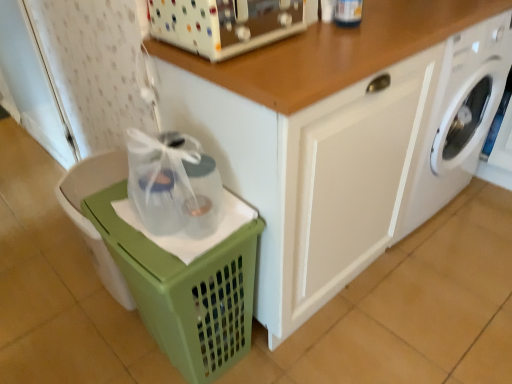
In order to face white glossy washing machine at lower right, should I rotate leftwards or rightwards?

A 22.754 degree turn to the right will do.

Describe the element at coordinates (224, 24) in the screenshot. I see `white plastic toaster at upper center` at that location.

Find the location of `green plastic basket at lower left`. green plastic basket at lower left is located at coordinates (89, 221).

From the image's perspective, is green plastic basket at lower left positioned above or below white glossy washing machine at lower right?

Based on their image positions, green plastic basket at lower left is located beneath white glossy washing machine at lower right.

Can you confirm if green plastic basket at lower left is taller than white glossy washing machine at lower right?

No, green plastic basket at lower left is not taller than white glossy washing machine at lower right.

Who is bigger, green plastic basket at lower left or white glossy washing machine at lower right?

With larger size is white glossy washing machine at lower right.

Measure the distance from green plastic basket at lower left to white glossy washing machine at lower right.

1.06 meters.

Considering the relative sizes of white textured screen door at left and green plastic basket at lower left in the image provided, is white textured screen door at left bigger than green plastic basket at lower left?

Indeed, white textured screen door at left has a larger size compared to green plastic basket at lower left.

Can you confirm if white textured screen door at left is shorter than green plastic basket at lower left?

Incorrect, the height of white textured screen door at left does not fall short of that of green plastic basket at lower left.

The image size is (512, 384). I want to click on dish washer below the white textured screen door at left (from a real-world perspective), so click(89, 221).

Which of these two, white textured screen door at left or green plastic basket at lower left, is wider?

Wider between the two is green plastic basket at lower left.

Consider the image. Is white textured screen door at left a part of green plastic basket at lower left?

Definitely not — white textured screen door at left is not inside green plastic basket at lower left.

Between green plastic basket at lower left and white textured screen door at left, which one has more height?

white textured screen door at left is taller.

From the image's perspective, who appears lower, green plastic basket at lower left or white textured screen door at left?

green plastic basket at lower left appears lower in the image.

Considering the sizes of green plastic basket at lower left and white textured screen door at left in the image, is green plastic basket at lower left wider or thinner than white textured screen door at left?

green plastic basket at lower left is wider than white textured screen door at left.

Which object is positioned more to the right, white plastic toaster at upper center or white glossy washing machine at lower right?

white glossy washing machine at lower right.

Measure the distance from white plastic toaster at upper center to white glossy washing machine at lower right.

white plastic toaster at upper center is 69.51 centimeters from white glossy washing machine at lower right.

At what (x,y) coordinates should I click in order to perform the action: click on appliance that appears above the white glossy washing machine at lower right (from a real-world perspective). Please return your answer as a coordinate pair (x, y). The height and width of the screenshot is (384, 512). Looking at the image, I should click on (224, 24).

Is white plastic toaster at upper center smaller than white glossy washing machine at lower right?

Indeed, white plastic toaster at upper center has a smaller size compared to white glossy washing machine at lower right.

Is green plastic basket at lower left oriented away from white plastic toaster at upper center?

No, green plastic basket at lower left's orientation is not away from white plastic toaster at upper center.

Based on the photo, from a real-world perspective, is green plastic basket at lower left positioned over white plastic toaster at upper center based on gravity?

No.

How different are the orientations of green plastic basket at lower left and white plastic toaster at upper center in degrees?

92.2 degrees.

Who is smaller, green plastic basket at lower left or white plastic toaster at upper center?

white plastic toaster at upper center.

Which object is further away from the camera taking this photo, white glossy cabinet at center or green plastic basket at lower left?

Positioned behind is green plastic basket at lower left.

Considering the relative sizes of white glossy cabinet at center and green plastic basket at lower left in the image provided, is white glossy cabinet at center taller than green plastic basket at lower left?

Yes.

From the image's perspective, is white glossy cabinet at center above green plastic basket at lower left?

Yes, from the image's perspective, white glossy cabinet at center is over green plastic basket at lower left.

Can you see white glossy cabinet at center touching green plastic basket at lower left?

No, white glossy cabinet at center is not in contact with green plastic basket at lower left.

From the image's perspective, which is below, white textured screen door at left or white plastic toaster at upper center?

white plastic toaster at upper center.

Is white plastic toaster at upper center at the back of white textured screen door at left?

No, white textured screen door at left's orientation is not away from white plastic toaster at upper center.

Which of these two, white textured screen door at left or white plastic toaster at upper center, is thinner?

white textured screen door at left.

Find the location of a particular element. Image resolution: width=512 pixels, height=384 pixels. dish washer to the left of white glossy washing machine at lower right is located at coordinates (89, 221).

Where is `screen door located above the green plastic basket at lower left (from the image's perspective)`? screen door located above the green plastic basket at lower left (from the image's perspective) is located at coordinates (32, 84).

Looking at this image, estimate the real-world distances between objects in this image. Which object is closer to green plastic basket at lower left, white glossy washing machine at lower right or green plastic basket at lower left?

green plastic basket at lower left lies closer to green plastic basket at lower left than the other object.

Considering their positions, is white glossy washing machine at lower right positioned further to green plastic basket at lower left than white plastic toaster at upper center?

The object further to green plastic basket at lower left is white glossy washing machine at lower right.

Looking at the image, which one is located further to white plastic toaster at upper center, white glossy washing machine at lower right or white glossy cabinet at center?

white glossy washing machine at lower right lies further to white plastic toaster at upper center than the other object.

Considering their positions, is green plastic basket at lower left positioned further to white textured screen door at left than white plastic toaster at upper center?

Among the two, white plastic toaster at upper center is located further to white textured screen door at left.

Which object lies nearer to the anchor point white glossy cabinet at center, green plastic basket at lower left or green plastic basket at lower left?

Based on the image, green plastic basket at lower left appears to be nearer to white glossy cabinet at center.

In the scene shown: Which object lies further to the anchor point green plastic basket at lower left, white plastic toaster at upper center or white glossy cabinet at center?

white plastic toaster at upper center.

In the scene shown: From the image, which object appears to be nearer to white textured screen door at left, white glossy washing machine at lower right or white plastic toaster at upper center?

white plastic toaster at upper center lies closer to white textured screen door at left than the other object.

Which object lies nearer to the anchor point green plastic basket at lower left, white plastic toaster at upper center or white textured screen door at left?

white plastic toaster at upper center lies closer to green plastic basket at lower left than the other object.

Where is `basket located between green plastic basket at lower left and white glossy washing machine at lower right in the left-right direction`? basket located between green plastic basket at lower left and white glossy washing machine at lower right in the left-right direction is located at coordinates (185, 290).

Where is `cabinetry between white plastic toaster at upper center and white glossy washing machine at lower right`? The height and width of the screenshot is (384, 512). cabinetry between white plastic toaster at upper center and white glossy washing machine at lower right is located at coordinates (339, 135).

You are a GUI agent. You are given a task and a screenshot of the screen. Output one action in this format:
    pyautogui.click(x=<x>, y=<y>)
    Task: Click on the basket located between green plastic basket at lower left and white glossy cabinet at center in the left-right direction
    
    Given the screenshot: What is the action you would take?
    pyautogui.click(x=185, y=290)

Locate an element on the screen. cabinetry that lies between white plastic toaster at upper center and green plastic basket at lower left from top to bottom is located at coordinates (339, 135).